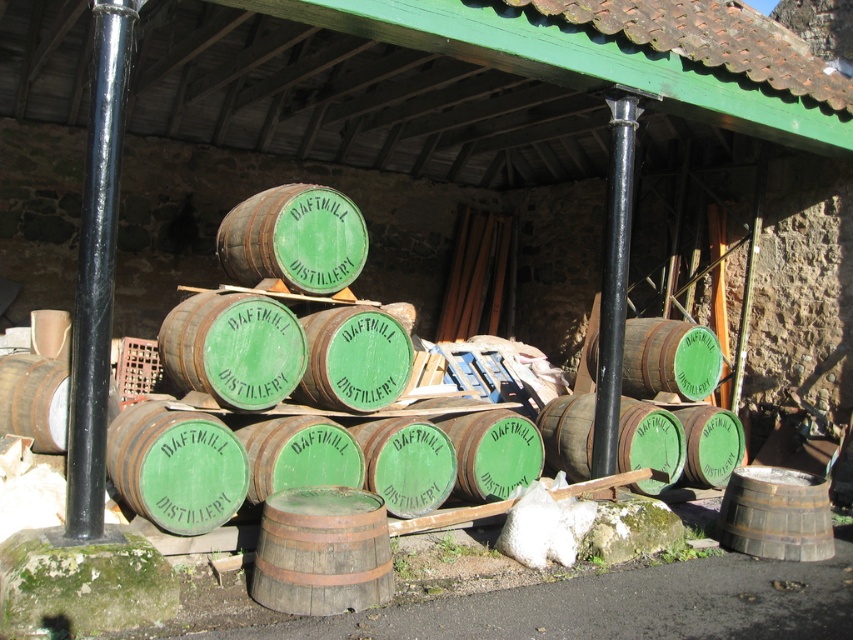
Question: Which point is farther to the camera?

Choices:
 (A) green wooden barrel at center
 (B) rustic wooden barrel at center

Answer: (A)

Question: Among these objects, which one is nearest to the camera?

Choices:
 (A) black metal pole at left
 (B) green wooden barrel at center
 (C) rustic wooden barrel at center

Answer: (A)

Question: Does black metal pole at left come behind rustic wooden barrel at center?

Choices:
 (A) no
 (B) yes

Answer: (A)

Question: Does rustic wooden barrel at center have a smaller size compared to green wooden barrel at center?

Choices:
 (A) yes
 (B) no

Answer: (A)

Question: Based on their relative distances, which object is nearer to the black metal pole at left?

Choices:
 (A) green wooden barrel at center
 (B) rustic wooden barrel at center

Answer: (B)

Question: Does rustic wooden barrel at center have a greater width compared to green wooden barrel at center?

Choices:
 (A) no
 (B) yes

Answer: (A)